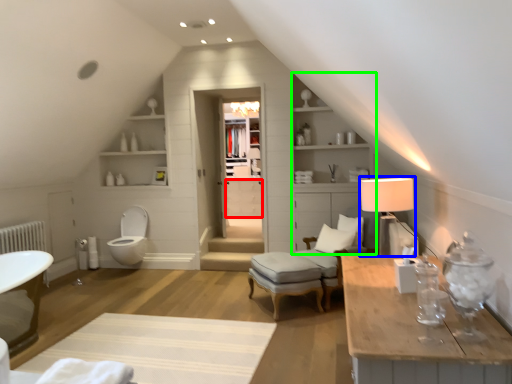
Question: Which object is positioned closest to drawer (highlighted by a red box)? Select from table lamp (highlighted by a blue box) and dresser (highlighted by a green box).

Choices:
 (A) table lamp
 (B) dresser

Answer: (B)